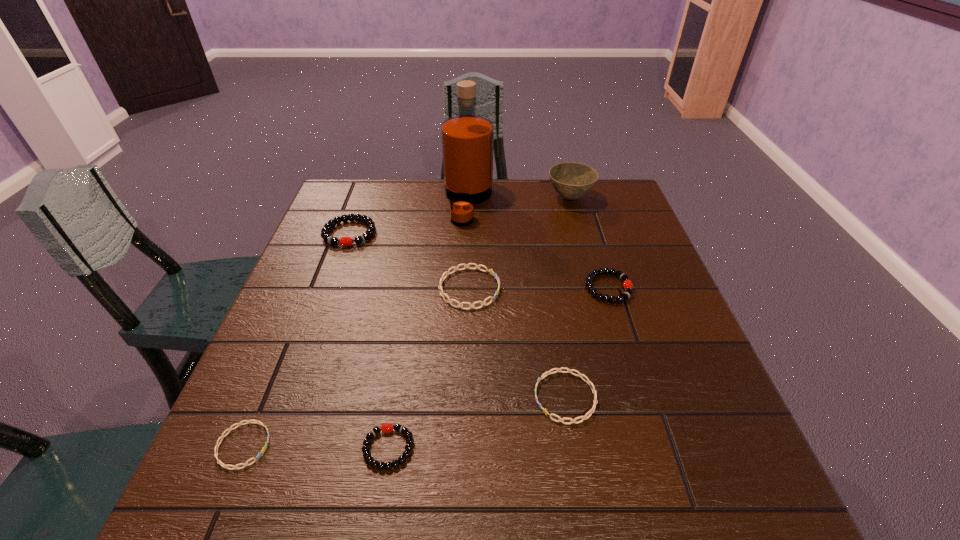
You are a GUI agent. You are given a task and a screenshot of the screen. Output one action in this format:
    pyautogui.click(x=<x>, y=<y>)
    Task: Click on the free space that is in between the seventh shortest object and the second blue bracelet from left to right
    The image size is (960, 540).
    Given the screenshot: What is the action you would take?
    pyautogui.click(x=519, y=244)

The image size is (960, 540). What are the coordinates of `vacant space in between the second blue bracelet from right to left and the shortest object` in the screenshot? It's located at (356, 367).

You are a GUI agent. You are given a task and a screenshot of the screen. Output one action in this format:
    pyautogui.click(x=<x>, y=<y>)
    Task: Click on the vacant space that is in between the leftmost black bracelet and the nearest black bracelet
    This screenshot has width=960, height=540.
    Given the screenshot: What is the action you would take?
    pyautogui.click(x=369, y=341)

Where is `empty location between the second tallest object and the rightmost blue bracelet`? The image size is (960, 540). empty location between the second tallest object and the rightmost blue bracelet is located at coordinates (567, 298).

Locate an element on the screen. vacant space in between the nearest black bracelet and the rightmost blue bracelet is located at coordinates (477, 422).

Identify the location of unoccupied area between the second bracelet from right to left and the liquor. (516, 299).

Select which object appears as the third closest to the biggest black bracelet. Please provide its 2D coordinates. Your answer should be formatted as a tuple, i.e. [(x, y)], where the tuple contains the x and y coordinates of a point satisfying the conditions above.

[(571, 180)]

Identify which object is the seventh nearest to the second smallest black bracelet. Please provide its 2D coordinates. Your answer should be formatted as a tuple, i.e. [(x, y)], where the tuple contains the x and y coordinates of a point satisfying the conditions above.

[(263, 450)]

Point out which bracelet is positioned as the fifth nearest to the rightmost bracelet. Please provide its 2D coordinates. Your answer should be formatted as a tuple, i.e. [(x, y)], where the tuple contains the x and y coordinates of a point satisfying the conditions above.

[(263, 450)]

Identify which bracelet is the nearest to the smallest blue bracelet. Please provide its 2D coordinates. Your answer should be formatted as a tuple, i.e. [(x, y)], where the tuple contains the x and y coordinates of a point satisfying the conditions above.

[(386, 428)]